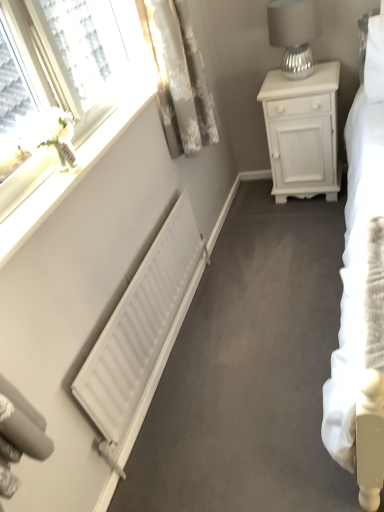
At what (x,y) coordinates should I click in order to perform the action: click on free point to the right of white matte radiator at lower left. Please return your answer as a coordinate pair (x, y). This screenshot has height=512, width=384. Looking at the image, I should click on (257, 309).